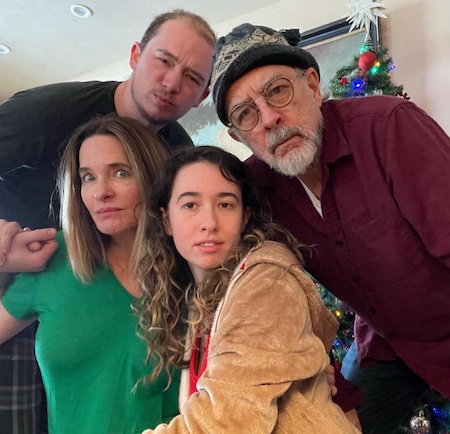
At what (x,y) coordinates should I click in order to perform the action: click on christmas tree. Please return your answer as a coordinate pair (x, y). The height and width of the screenshot is (434, 450). Looking at the image, I should click on (345, 311).